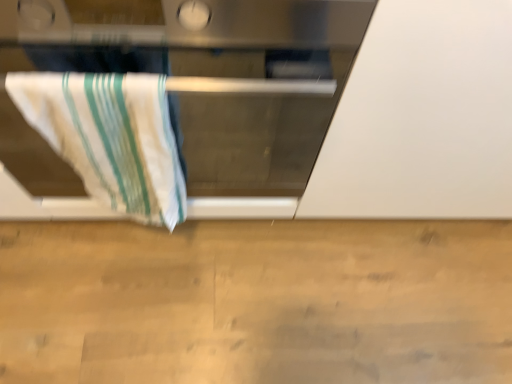
The width and height of the screenshot is (512, 384). I want to click on free space above white cotton towel at left (from a real-world perspective), so click(84, 62).